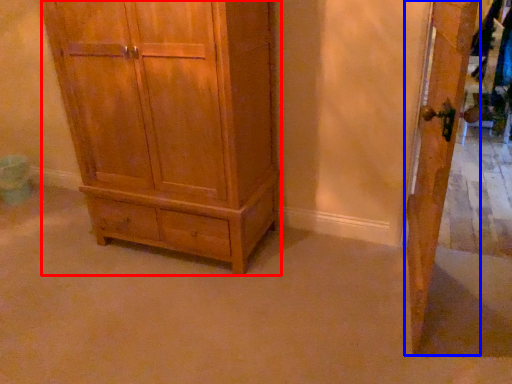
Question: Which object appears closest to the camera in this image, chest of drawers (highlighted by a red box) or door (highlighted by a blue box)?

Choices:
 (A) chest of drawers
 (B) door

Answer: (B)